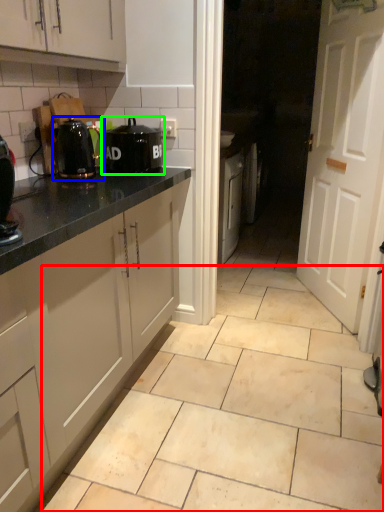
Question: Which is nearer to the ceramic tile (highlighted by a red box)? kitchen appliance (highlighted by a blue box) or home appliance (highlighted by a green box).

Choices:
 (A) kitchen appliance
 (B) home appliance

Answer: (B)